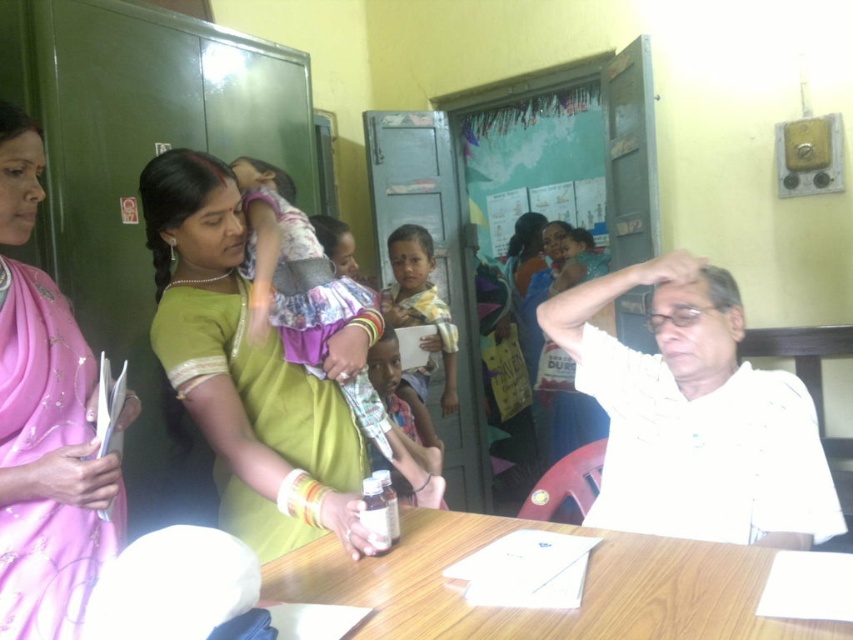
You are a photographer taking a photo of the green silk saree at center and the yellow clothed child at center. Which object should you focus on first to ensure both are in focus?

The green silk saree at center is in front of the yellow clothed child at center, so you should focus on the green silk saree at center first to ensure both are in focus.

You are a nurse in the clinic and need to place a 12 inch wide medical kit on the wooden table at center. The green silk saree at center is currently draped over the table. Can the medical kit be placed on the table without moving the saree?

The green silk saree at center is 14.16 inches away from wooden table at center, so the medical kit can be placed on the table since the distance between the saree and the table is greater than the kit width.